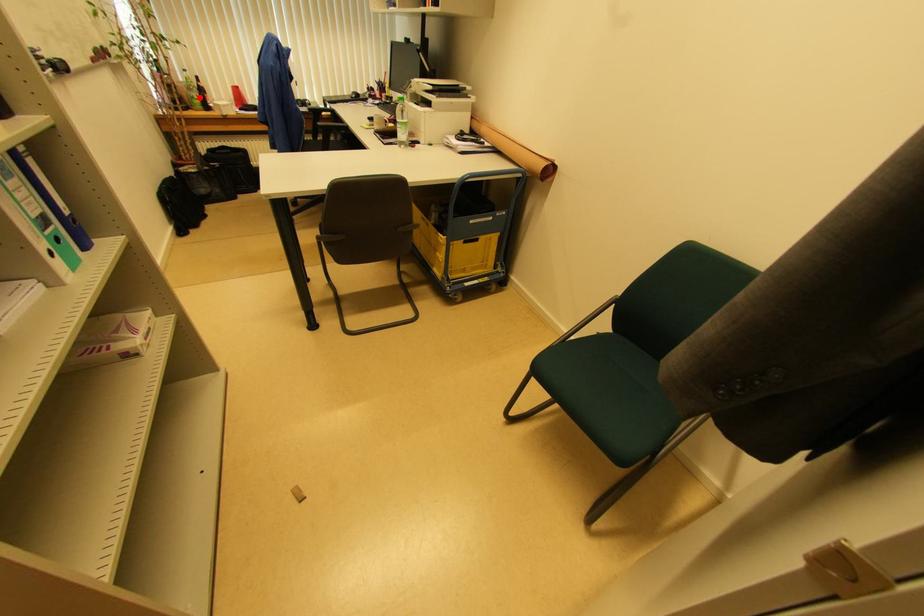
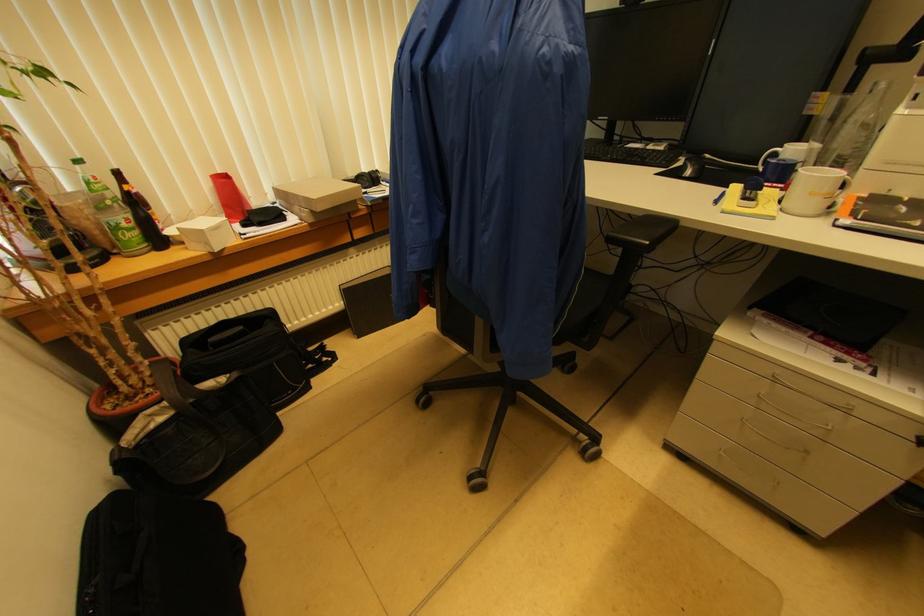
Find the pixel in the second image that matches the highlighted location in the first image.

(131, 219)